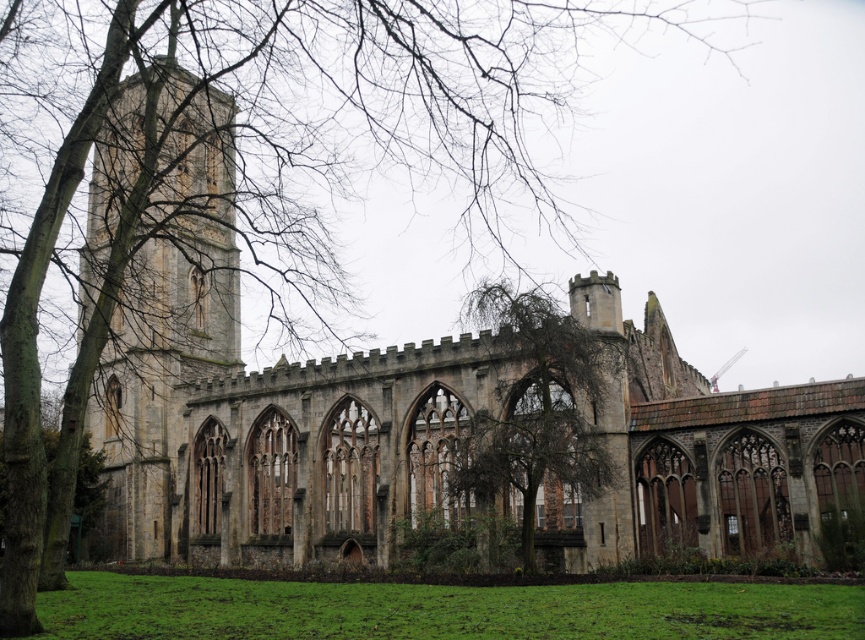
Question: Which point is farther from the camera taking this photo?

Choices:
 (A) (485, 304)
 (B) (227, 340)
 (C) (202, 589)

Answer: (B)

Question: Which point is farther from the camera taking this photo?

Choices:
 (A) (163, 84)
 (B) (292, 636)

Answer: (A)

Question: Considering the relative positions of stone tower at left and brown textured tree at center in the image provided, where is stone tower at left located with respect to brown textured tree at center?

Choices:
 (A) right
 (B) left

Answer: (B)

Question: Is stone tower at left smaller than brown textured tree at center?

Choices:
 (A) yes
 (B) no

Answer: (B)

Question: Which object is positioned farthest from the green grass at lower center?

Choices:
 (A) brown textured tree at center
 (B) stone tower at left

Answer: (B)

Question: Can you confirm if green grass at lower center is positioned above brown textured tree at center?

Choices:
 (A) yes
 (B) no

Answer: (B)